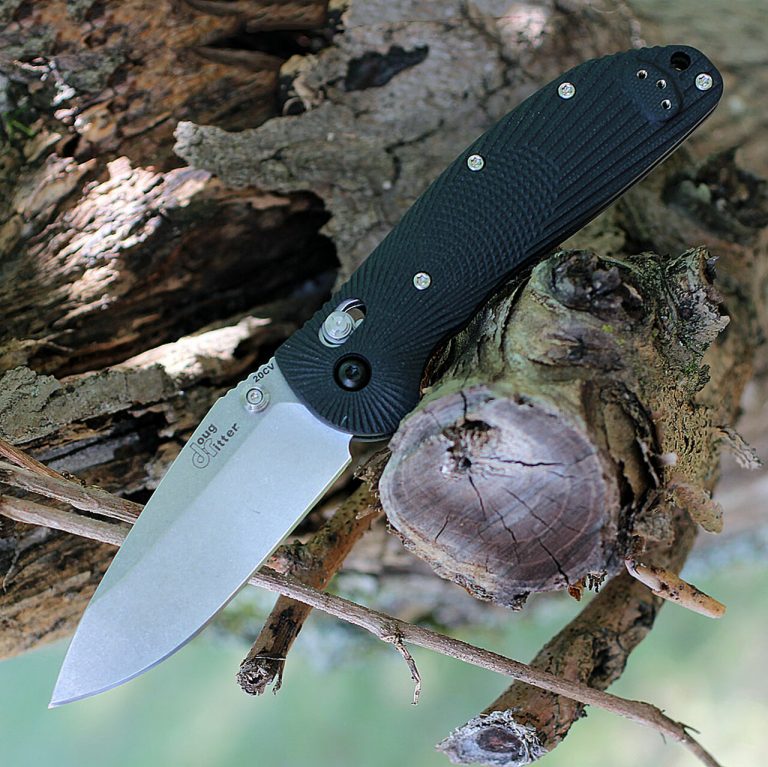
You are a GUI agent. You are given a task and a screenshot of the screen. Output one action in this format:
    pyautogui.click(x=<x>, y=<y>)
    Task: Click on the handle
    The height and width of the screenshot is (767, 768).
    Given the screenshot: What is the action you would take?
    pyautogui.click(x=472, y=215)